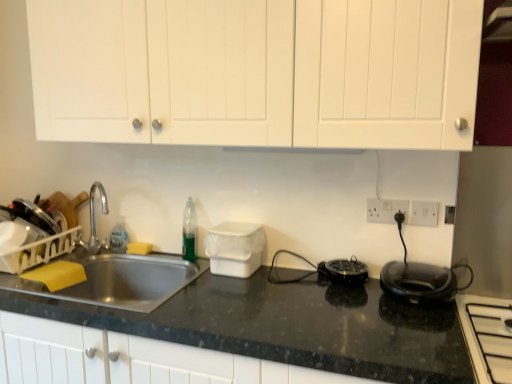
Find the location of a particular element. This screenshot has width=512, height=384. vacant space in black glossy electric kettle at right (from a real-world perspective) is located at coordinates (418, 298).